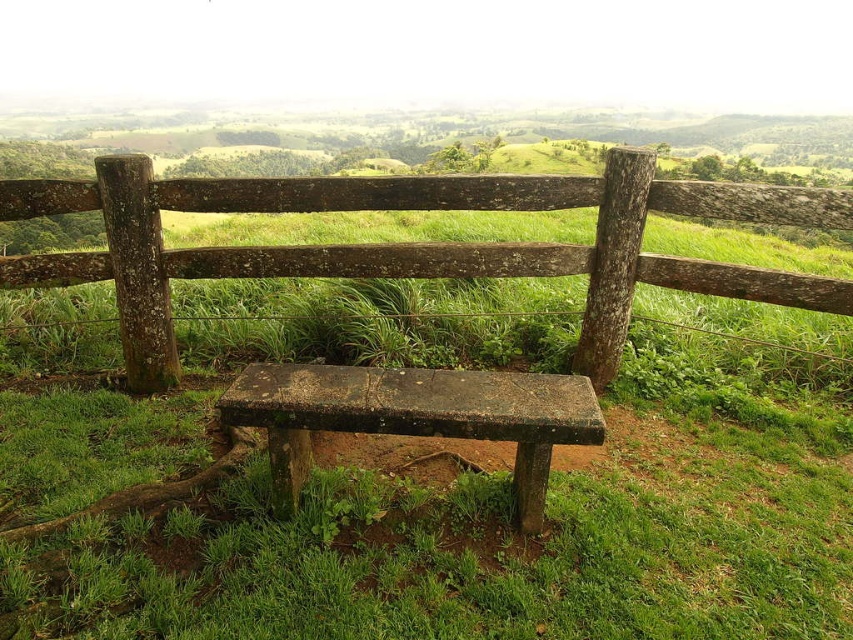
Question: Among these points, which one is nearest to the camera?

Choices:
 (A) (248, 272)
 (B) (238, 387)

Answer: (B)

Question: Observing the image, what is the correct spatial positioning of weathered wood fence at center in reference to rusty concrete bench at center?

Choices:
 (A) above
 (B) below

Answer: (A)

Question: Which object appears farthest from the camera in this image?

Choices:
 (A) rusty concrete bench at center
 (B) weathered wood fence at center

Answer: (B)

Question: Is weathered wood fence at center positioned in front of rusty concrete bench at center?

Choices:
 (A) yes
 (B) no

Answer: (B)

Question: Can you confirm if weathered wood fence at center is bigger than rusty concrete bench at center?

Choices:
 (A) no
 (B) yes

Answer: (B)

Question: Which point is farther to the camera?

Choices:
 (A) pos(483,186)
 (B) pos(392,426)

Answer: (A)